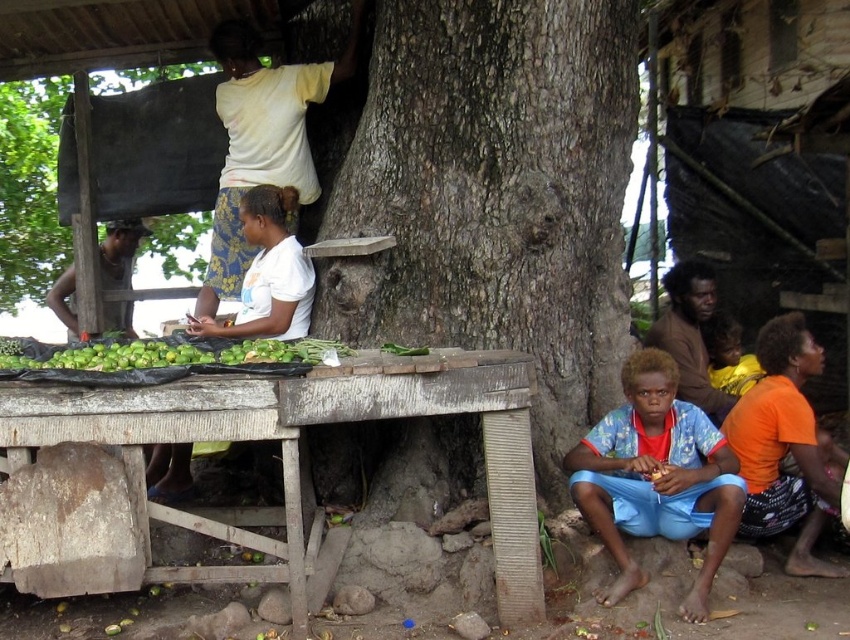
You are a delivery person who needs to place a 40 inch long package between the dark brown rough bark tree at center and the green matte vegetables at lower left. Can you fit the package between them without moving either object?

The dark brown rough bark tree at center is 38.88 inches from the green matte vegetables at lower left. Since the package is 40 inches long, it cannot fit between them as the distance is shorter than the package length.

You are planning to place a large wooden bench next to the dark brown rough bark tree at center. Given the space available, will the bench, which is as wide as the green matte vegetables at lower left, fit comfortably without being too cramped?

The dark brown rough bark tree at center is narrower than the green matte vegetables at lower left. Since the bench is as wide as the vegetables, it should fit comfortably next to the tree without being cramped.

You are a delivery person who needs to place a package between the blue printed fabric at lower right and the brown rough tree trunk at upper center. The package requires a space of 6 meters. Will there be enough space?

The blue printed fabric at lower right and brown rough tree trunk at upper center are 5.84 meters apart, so the space between them is insufficient for the package requiring 6 meters.